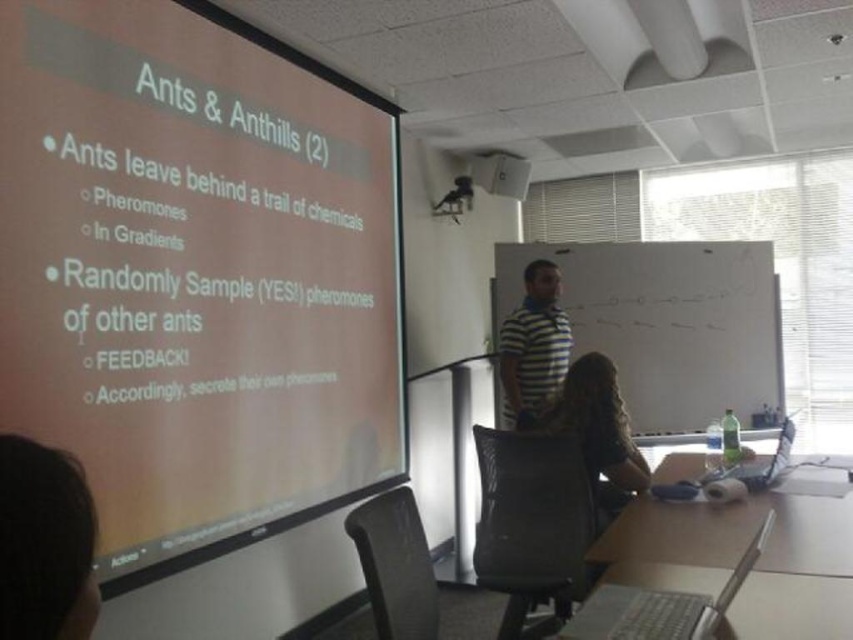
You are a student sitting in the classroom and need to place your textbook on the silver metallic table at lower right and the silver metallic laptop at lower right. Which surface will require you to bend down more to place the textbook?

The silver metallic table at lower right has a lesser height compared to the silver metallic laptop at lower right, so placing the textbook on the silver metallic table at lower right will require bending down more.

You are a student sitting in the classroom and want to take notes on the slide about ants. You have a silver metallic laptop at lower right and dark brown hair at lower left. Which object is closer to you so you can reach it easily?

The dark brown hair at lower left is closer to the viewer than the silver metallic laptop at lower right, so you can reach it more easily.